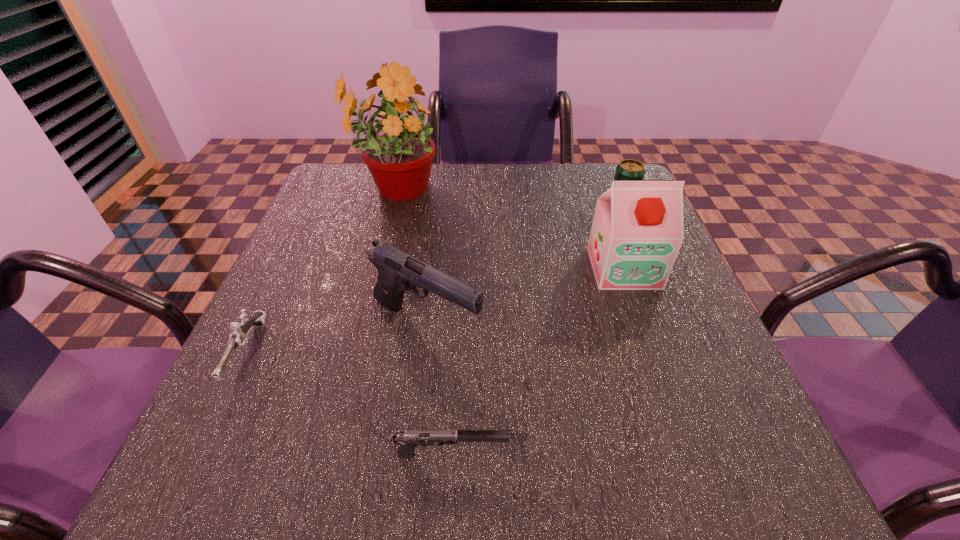
I want to click on vacant space situated on the front of the beer can, so coord(641,245).

Identify the location of vacant space located aimed along the barrel of the leftmost gun. The image size is (960, 540). [202, 447].

The image size is (960, 540). Identify the location of vacant region located at the muzzle end of the nearest object. (652, 454).

Identify the location of flowerpot at the far edge. (399, 154).

At what (x,y) coordinates should I click in order to perform the action: click on beer can that is at the far edge. Please return your answer as a coordinate pair (x, y). The image size is (960, 540). Looking at the image, I should click on (628, 169).

In order to click on object at the near edge in this screenshot , I will do `click(407, 440)`.

At what (x,y) coordinates should I click in order to perform the action: click on flowerpot that is at the left edge. Please return your answer as a coordinate pair (x, y). This screenshot has width=960, height=540. Looking at the image, I should click on (399, 154).

Locate an element on the screen. Image resolution: width=960 pixels, height=540 pixels. gun at the left edge is located at coordinates (238, 337).

This screenshot has height=540, width=960. I want to click on soya milk at the right edge, so click(637, 231).

At what (x,y) coordinates should I click in order to perform the action: click on beer can at the right edge. Please return your answer as a coordinate pair (x, y). The height and width of the screenshot is (540, 960). Looking at the image, I should click on (628, 169).